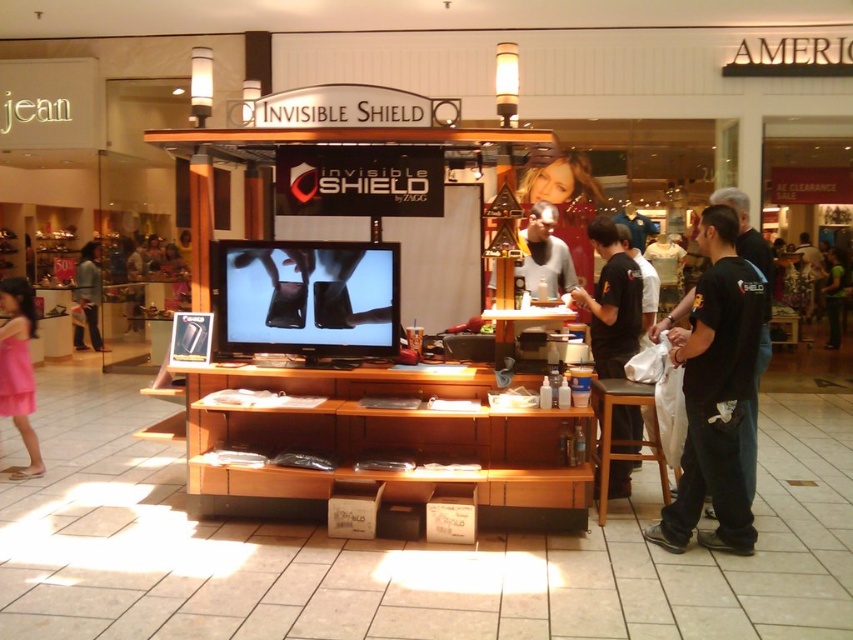
From the picture: Does black matte shirt at right appear under black cotton t-shirt at right?

No, black matte shirt at right is not below black cotton t-shirt at right.

Does point (634, 452) lie behind point (758, 244)?

Yes, it is behind point (758, 244).

Identify the location of black matte shirt at right. The image size is (853, 640). point(612,301).

Which is more to the left, black cotton shirt at right or brown wooden stool at lower right?

From the viewer's perspective, brown wooden stool at lower right appears more on the left side.

Is point (706, 278) positioned in front of point (630, 449)?

Yes, it is in front of point (630, 449).

You are a GUI agent. You are given a task and a screenshot of the screen. Output one action in this format:
    pyautogui.click(x=<x>, y=<y>)
    Task: Click on the black cotton shirt at right
    
    Given the screenshot: What is the action you would take?
    pyautogui.click(x=717, y=394)

In the scene shown: Between black matte shirt at right and matte black shirt at center, which one is positioned lower?

Positioned lower is black matte shirt at right.

This screenshot has height=640, width=853. I want to click on black matte shirt at right, so click(612, 301).